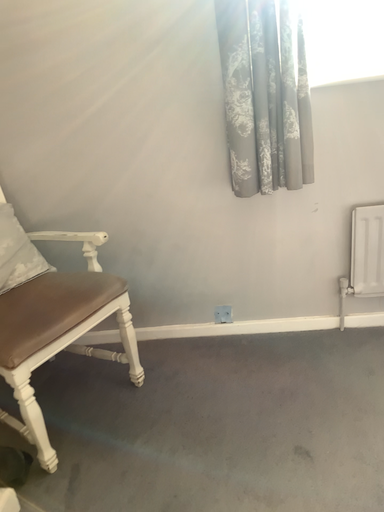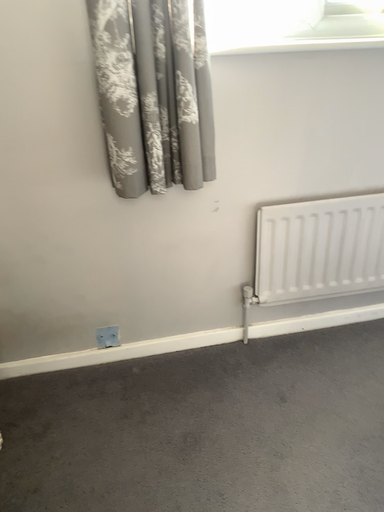
Question: How did the camera likely rotate when shooting the video?

Choices:
 (A) rotated left
 (B) rotated right

Answer: (B)